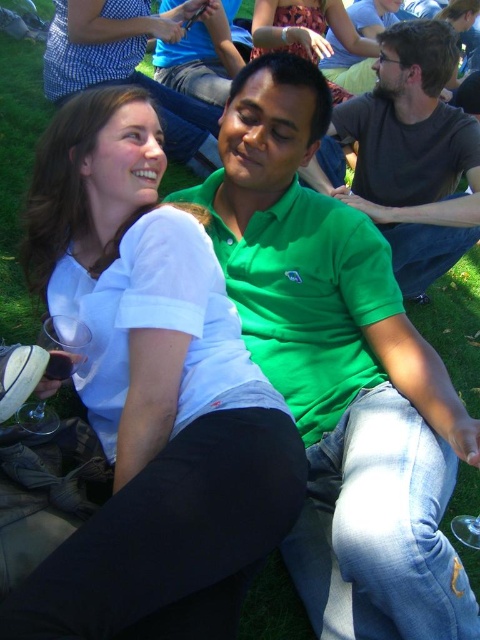
Question: Which object is farther from the camera taking this photo?

Choices:
 (A) green matte shirt at center
 (B) clear plastic cup at lower left
 (C) green cotton shirt at center

Answer: (A)

Question: Which object appears farthest from the camera in this image?

Choices:
 (A) clear plastic cup at lower left
 (B) transparent plastic wine glass at lower left
 (C) matte white shirt at upper left

Answer: (C)

Question: Does white matte shirt at center appear on the left side of green matte shirt at center?

Choices:
 (A) yes
 (B) no

Answer: (B)

Question: Which point is farther to the camera?

Choices:
 (A) (324, 52)
 (B) (369, 282)
 (C) (142, 269)
 (D) (72, 81)

Answer: (A)

Question: Does green cotton polo shirt at center have a greater width compared to green matte shirt at center?

Choices:
 (A) no
 (B) yes

Answer: (B)

Question: Is transparent plastic wine glass at lower left in front of clear plastic cup at lower left?

Choices:
 (A) no
 (B) yes

Answer: (B)